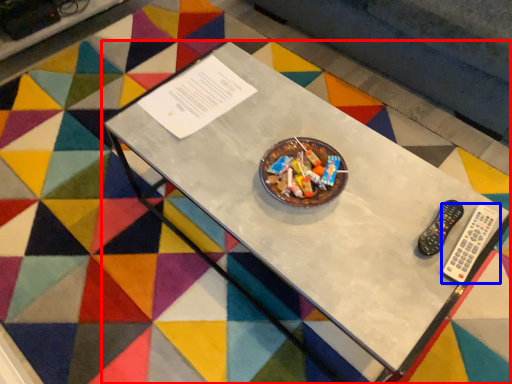
Question: Which of the following is the closest to the observer, table (highlighted by a red box) or remote control (highlighted by a blue box)?

Choices:
 (A) table
 (B) remote control

Answer: (A)